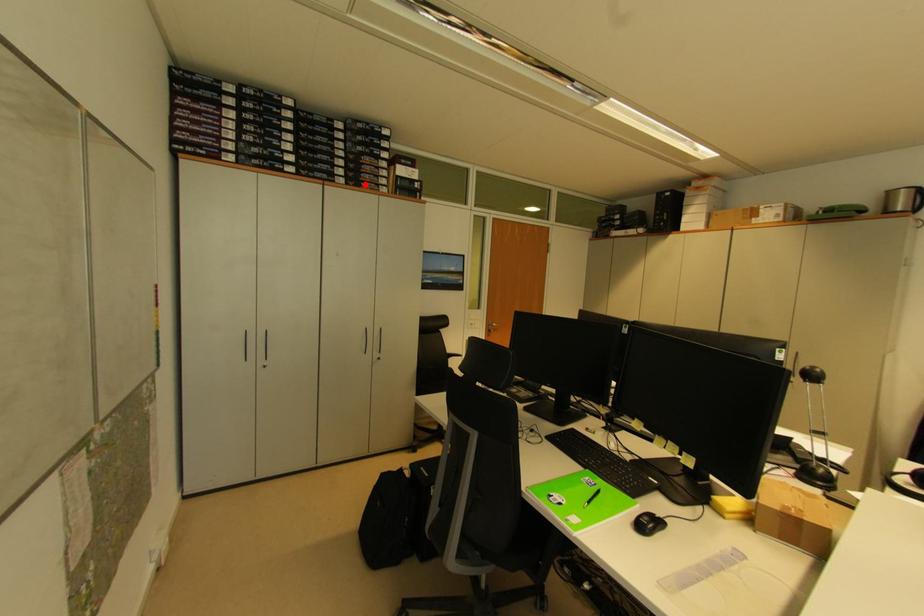
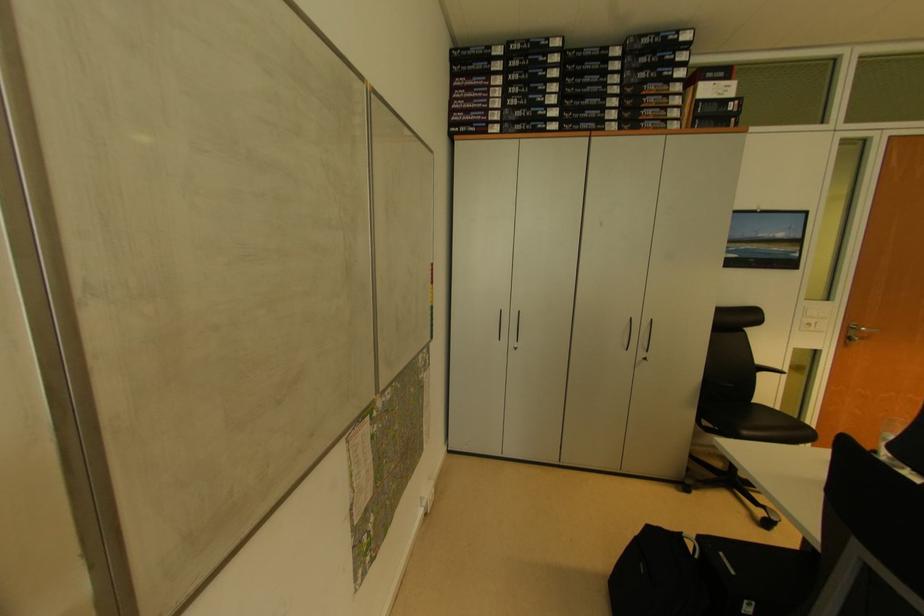
Question: I am providing you with two images of the same scene from different viewpoints. A red point is marked on the first image. Is the red point's position out of view in image 2?

Choices:
 (A) Yes
 (B) No

Answer: (B)